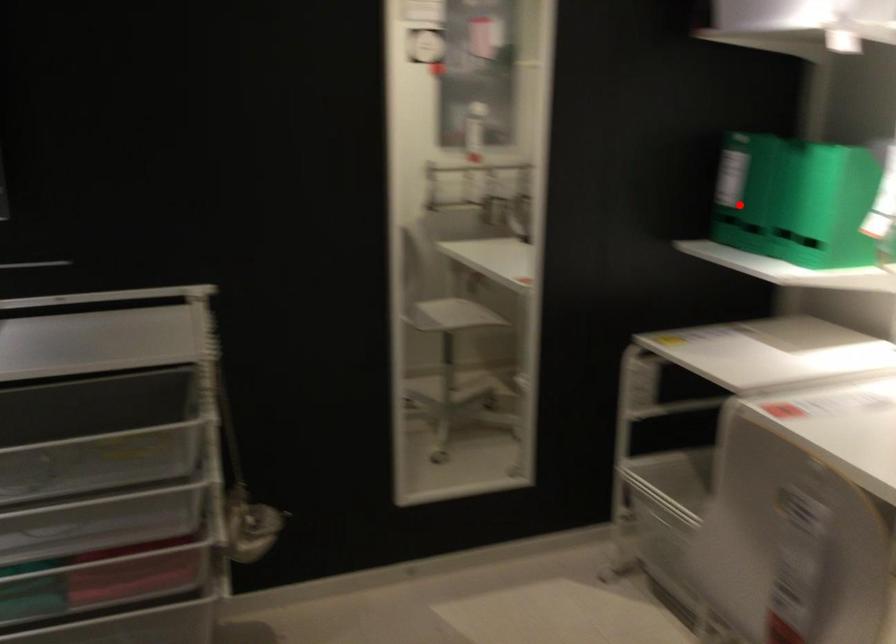
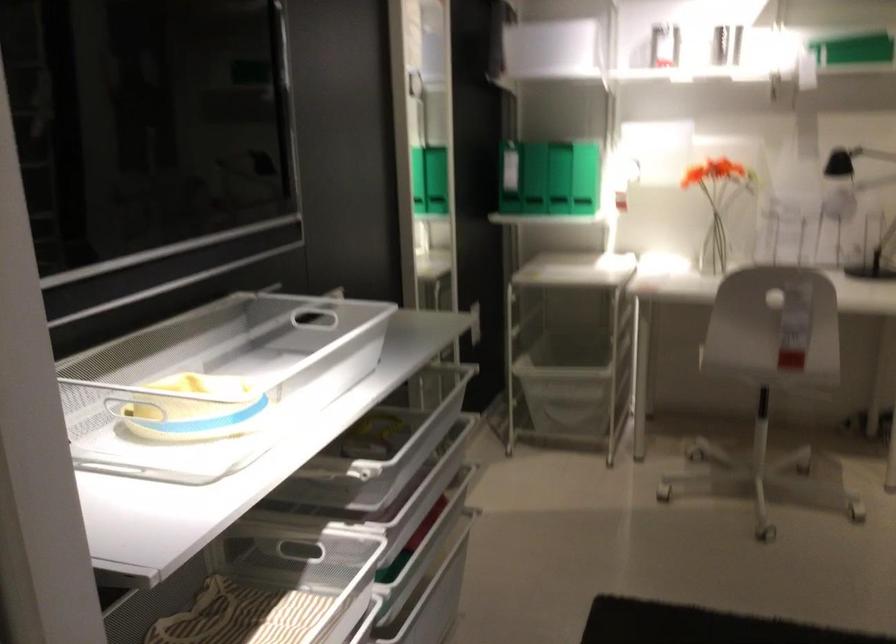
In the second image, find the point that corresponds to the highlighted location in the first image.

(533, 178)